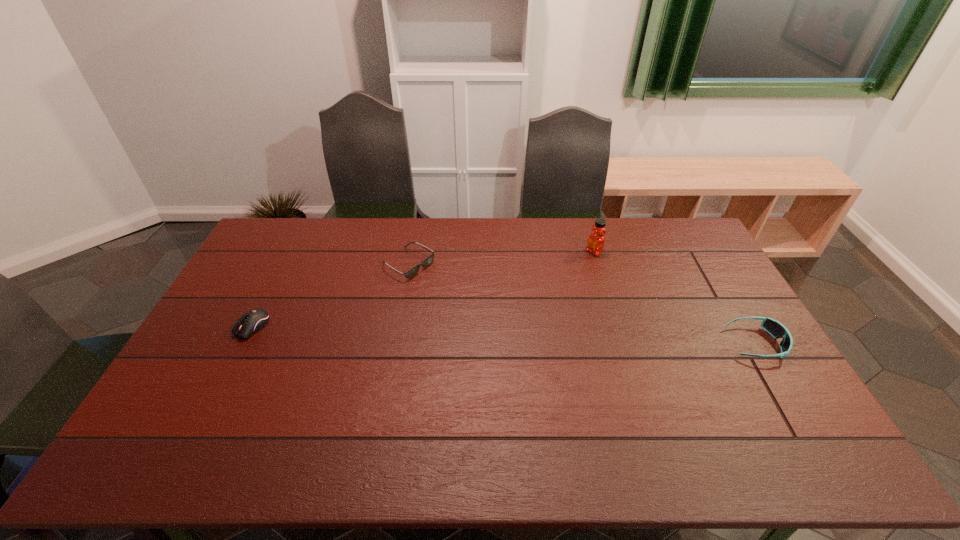
Locate an element on the screen. This screenshot has height=540, width=960. free space on the desktop that is between the leftmost object and the right sunglasses and is positioned on the front label of the honey is located at coordinates (453, 333).

You are a GUI agent. You are given a task and a screenshot of the screen. Output one action in this format:
    pyautogui.click(x=<x>, y=<y>)
    Task: Click on the vacant space on the desktop that is between the computer mouse and the nearer sunglasses and is positioned on the front-facing side of the shorter sunglasses
    The width and height of the screenshot is (960, 540).
    Given the screenshot: What is the action you would take?
    pyautogui.click(x=533, y=336)